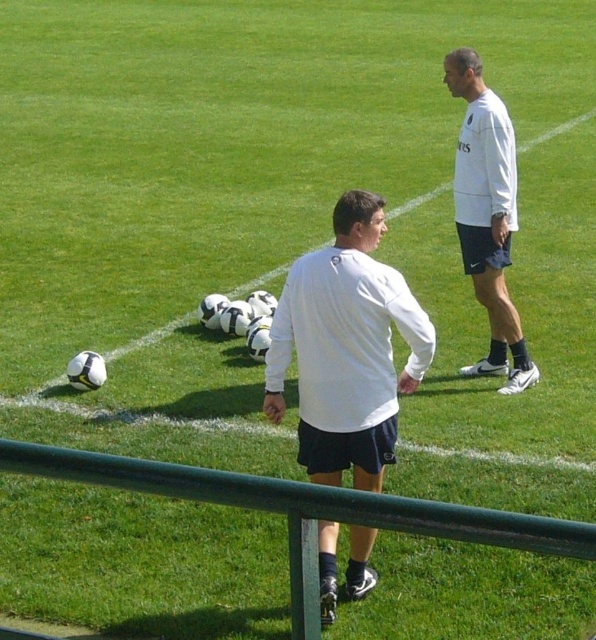
Does white matte shirt at center have a greater width compared to white matte shirt at upper right?

Yes, white matte shirt at center is wider than white matte shirt at upper right.

Between white matte shirt at center and white matte shirt at upper right, which one appears on the right side from the viewer's perspective?

white matte shirt at upper right

This screenshot has height=640, width=596. I want to click on white matte shirt at center, so click(346, 348).

This screenshot has width=596, height=640. Identify the location of green metal rail at lower center. (305, 509).

Is white matte shirt at center below green metal rail at lower center?

No, white matte shirt at center is not below green metal rail at lower center.

Is white matte shirt at center smaller than green metal rail at lower center?

No.

Identify the location of white matte shirt at center. (346, 348).